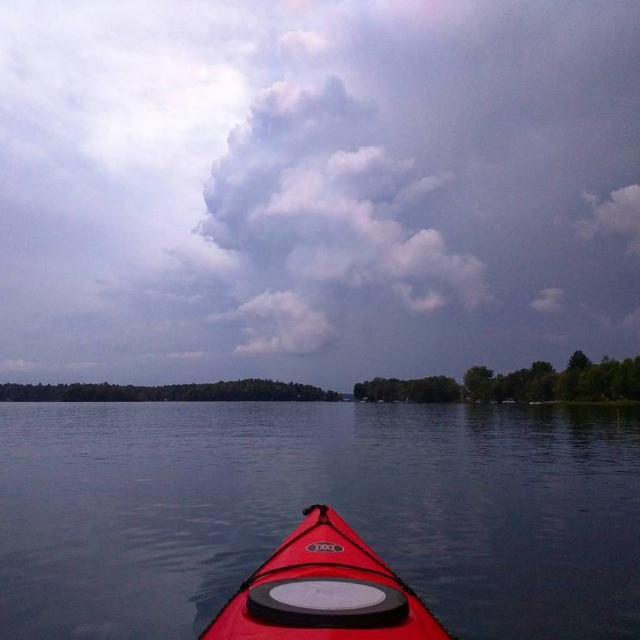
You are in a red kayak and want to know if the cloudy sky at upper center is wider than the transparent water at center. Can you confirm this based on the scene?

The cloudy sky at upper center is wider than the transparent water at center according to the description.

You are in a red kayak on a calm lake. You notice the transparent water at center and the matte red kayak at center. Which object appears taller in the image?

The transparent water at center appears taller than the matte red kayak at center in the image.

You are in a red kayak and want to know if the cloudy sky at upper center takes up more space in your view than the transparent water at center. Based on the scene, can you confirm this?

The cloudy sky at upper center is larger in size than transparent water at center, so yes, the cloudy sky at upper center does take up more space in the view than the transparent water at center.